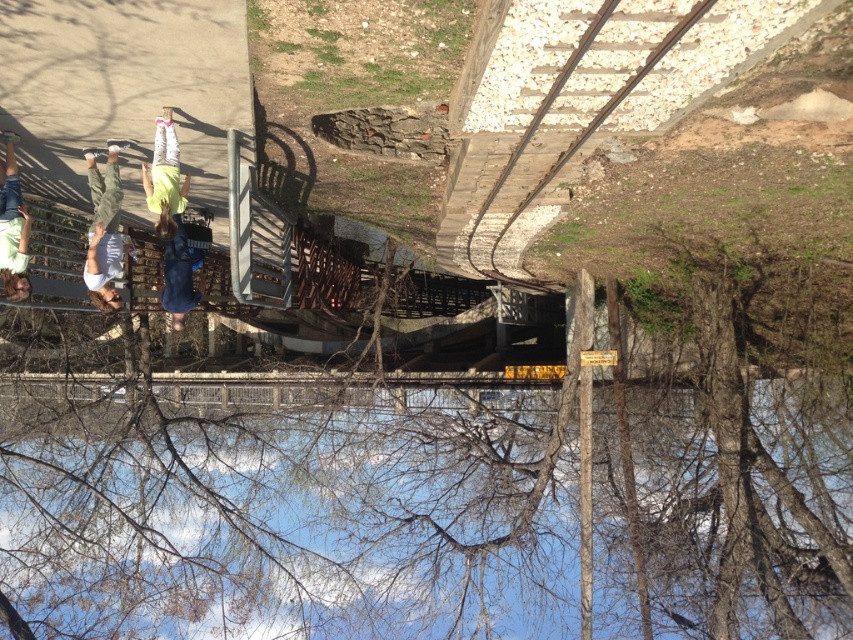
You are standing on the metal staircase looking down into the railway tunnel. You notice two people wearing green fabric pants at left and light green shirt at left. Which clothing item is closer to you?

The green fabric pants at left are closer to you because they are further to the viewer than the light green shirt at left.

You are standing on the metal staircase looking down into the railway tunnel. You notice two people wearing green fabric pants at left and light green fabric pants at center. Which person is closer to the bottom of the staircase?

The green fabric pants at left is positioned under the light green fabric pants at center, so the person wearing green fabric pants at left is closer to the bottom of the staircase.

You are standing on the metal staircase looking down. You see two people wearing light green fabric pants at center and denim shorts at center. Which clothing item is higher up on the staircase?

The light green fabric pants at center is above denim shorts at center, so the light green fabric pants at center is higher up on the staircase.